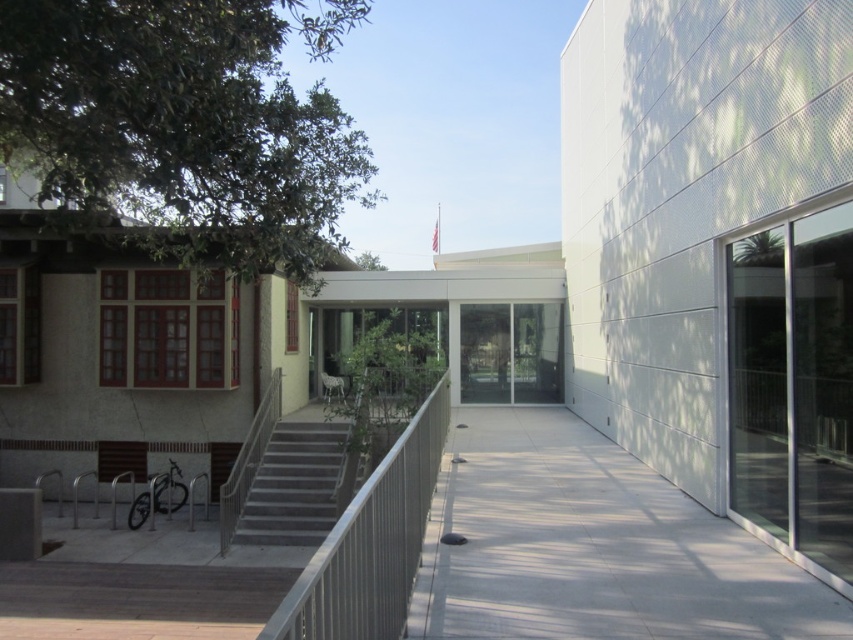
Question: Which point appears closest to the camera in this image?

Choices:
 (A) (358, 616)
 (B) (566, 516)
 (C) (254, 490)

Answer: (A)

Question: Is metallic silver balustrade at center-left smaller than gray concrete stairs at center?

Choices:
 (A) yes
 (B) no

Answer: (A)

Question: Does gray concrete pavement at center have a lesser width compared to gray concrete stairs at center?

Choices:
 (A) no
 (B) yes

Answer: (B)

Question: Which object is closer to the camera taking this photo?

Choices:
 (A) metallic silver balustrade at center-left
 (B) gray concrete stairs at center
 (C) gray concrete pavement at center

Answer: (A)

Question: Considering the relative positions of gray concrete pavement at center and gray concrete stairs at center in the image provided, where is gray concrete pavement at center located with respect to gray concrete stairs at center?

Choices:
 (A) above
 (B) below

Answer: (A)

Question: Which point is closer to the camera taking this photo?

Choices:
 (A) (413, 476)
 (B) (676, 518)

Answer: (A)